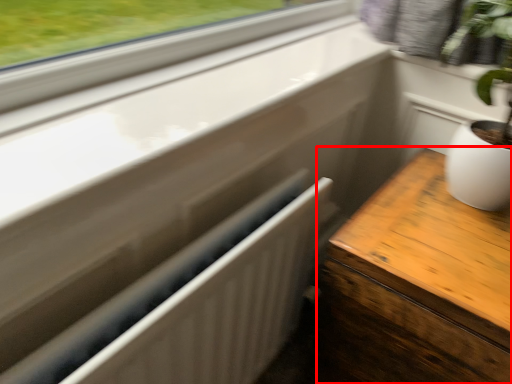
Question: From the image's perspective, where is table (annotated by the red box) located relative to radiator?

Choices:
 (A) above
 (B) below

Answer: (B)